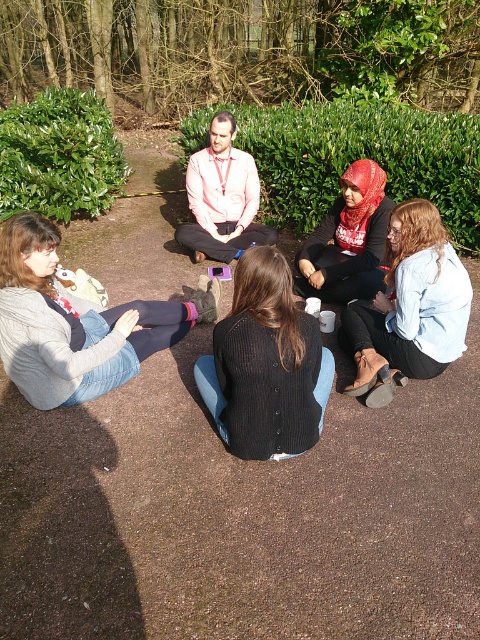
You are a photographer trying to capture a candid shot of the group without moving anyone. Since the knitted grey sweater at lower left and the light blue denim jacket at lower right are blocking each other, which one should you adjust to frame the group better?

The knitted grey sweater at lower left is in front of the light blue denim jacket at lower right, so you should adjust the knitted grey sweater at lower left to frame the group better.

You are standing at the center of the paved pathway where the group is sitting. You need to reach the black ribbed sweater at center without stepping on anyone. Which direction should you move to first?

The black ribbed sweater at center is located at point (265,364), so you should move towards the coordinates where it is placed. Since you are already at the center, you might need to adjust your position slightly towards the sweater.